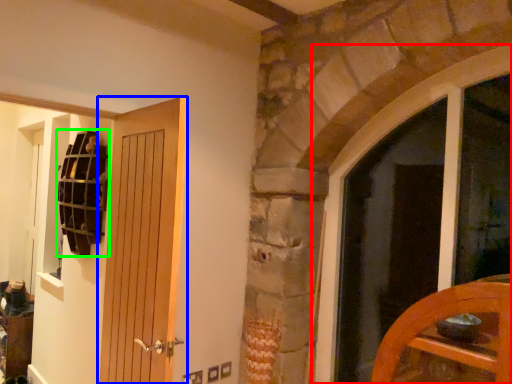
Question: Which is nearer to the window (highlighted by a red box)? door (highlighted by a blue box) or shelf (highlighted by a green box).

Choices:
 (A) door
 (B) shelf

Answer: (A)